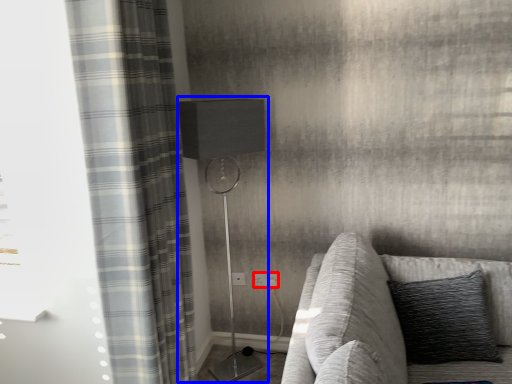
Question: Which of the following is the farthest to the observer, electric outlet (highlighted by a red box) or table lamp (highlighted by a blue box)?

Choices:
 (A) electric outlet
 (B) table lamp

Answer: (A)